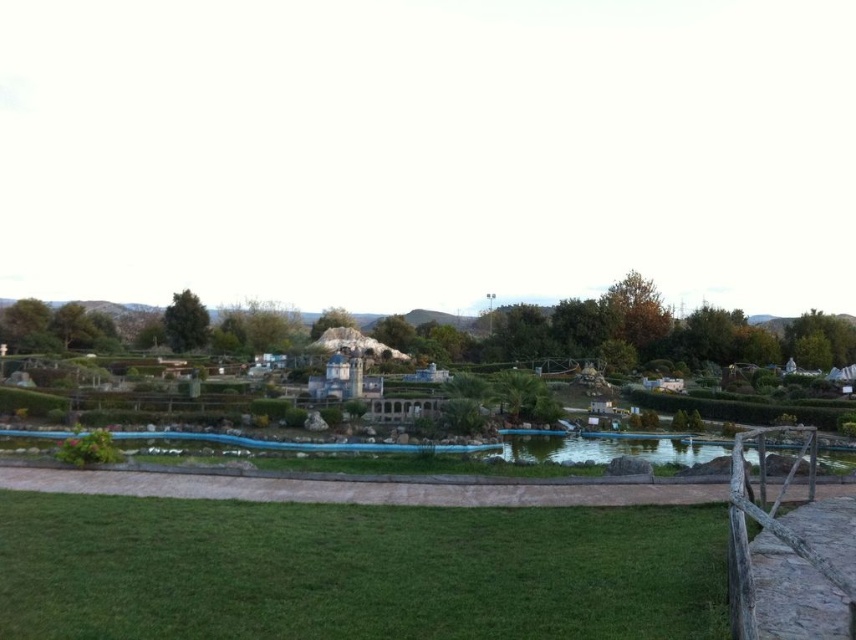
You are a miniature park designer planning to install a new pathway between the smooth concrete miniature park at center and the transparent blue pond at center. The pathway must be exactly 30 meters long. Based on the current layout, will the existing space accommodate this new pathway without any adjustments?

The distance between the smooth concrete miniature park at center and the transparent blue pond at center is 35.07 meters. Since the proposed pathway is only 30 meters long, it will not span the entire distance. Therefore, the existing space cannot accommodate the 30m pathway without adjustments to shorten the distance between them.

You are designing a miniature garden and have two ponds to choose from. The transparent blue pond at center and the green glass pond at center. Which pond would you recommend if you want the one that occupies more space horizontally?

The transparent blue pond at center is wider than the green glass pond at center, so it would occupy more horizontal space and be the better choice for that requirement.